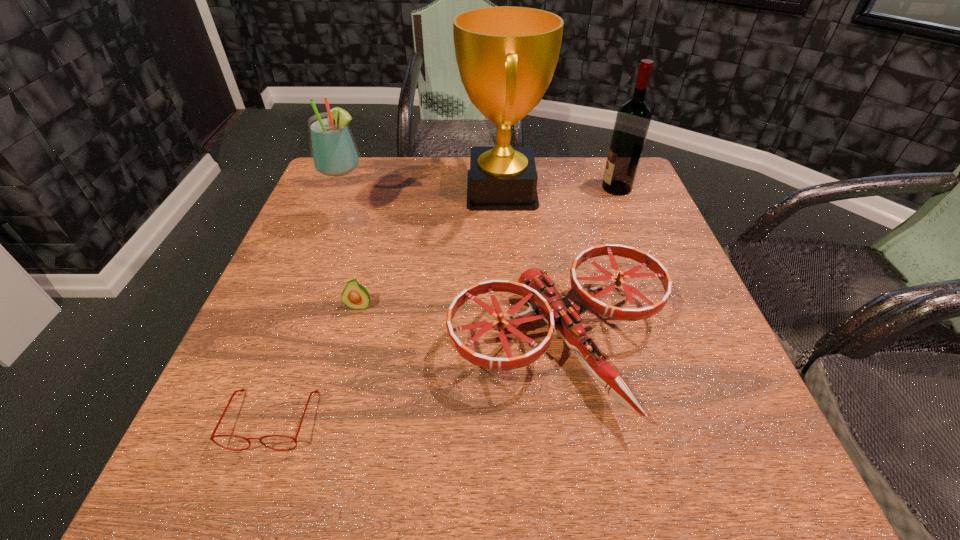
Locate an element on the screen. This screenshot has height=540, width=960. the tallest object is located at coordinates (506, 56).

Where is `the right alcohol`? This screenshot has width=960, height=540. the right alcohol is located at coordinates (633, 118).

Locate an element on the screen. The image size is (960, 540). the nearer alcohol is located at coordinates coord(334,154).

Where is `the fourth tallest object`? The width and height of the screenshot is (960, 540). the fourth tallest object is located at coordinates (562, 313).

Locate an element on the screen. avocado is located at coordinates (355, 296).

This screenshot has height=540, width=960. In order to click on the shortest object in this screenshot , I will do `click(242, 390)`.

Locate an element on the screen. Image resolution: width=960 pixels, height=540 pixels. vacant region located 0.190m on the front-facing side of the tallest object is located at coordinates (389, 191).

Locate an element on the screen. This screenshot has width=960, height=540. blank space located on the front-facing side of the tallest object is located at coordinates (371, 191).

At what (x,y) coordinates should I click in order to perform the action: click on free space located 0.090m on the front-facing side of the tallest object. Please return your answer as a coordinate pair (x, y). Looking at the image, I should click on (426, 191).

Locate an element on the screen. vacant region located 0.360m on the front and back of the farther alcohol is located at coordinates (469, 188).